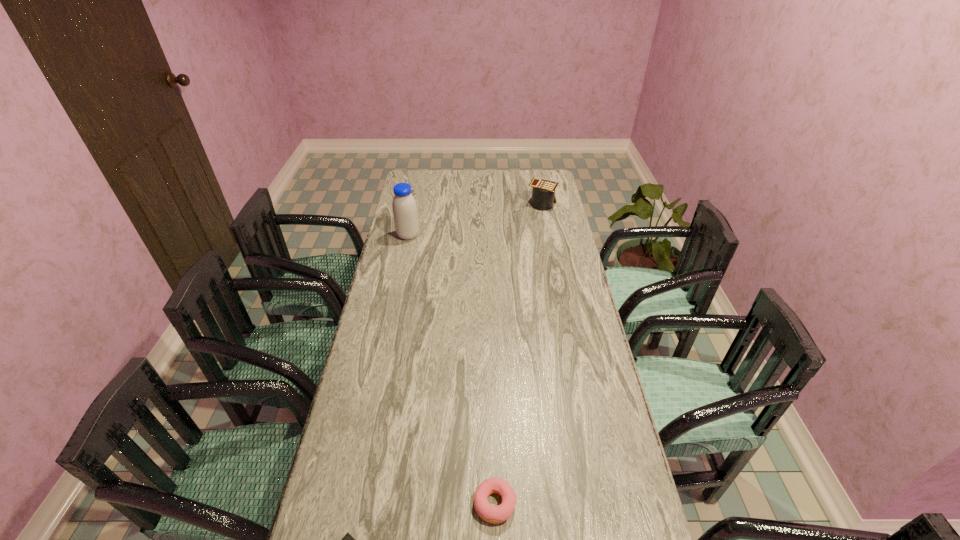
Find the location of `free space between the second shortest object and the soya milk`. free space between the second shortest object and the soya milk is located at coordinates (451, 369).

Identify the location of object that is the second nearest to the second shortest object. This screenshot has width=960, height=540. click(x=404, y=207).

You are a GUI agent. You are given a task and a screenshot of the screen. Output one action in this format:
    pyautogui.click(x=<x>, y=<y>)
    Task: Click on the object that is the nearest to the taller calculator
    The width and height of the screenshot is (960, 540).
    Given the screenshot: What is the action you would take?
    pyautogui.click(x=404, y=207)

At what (x,y) coordinates should I click in order to perform the action: click on vacant space that satisfies the following two spatial constraints: 1. on the back side of the second shortest object; 2. on the left side of the farther calculator. Please return your answer as a coordinate pair (x, y). This screenshot has height=540, width=960. Looking at the image, I should click on (488, 204).

I want to click on free region that satisfies the following two spatial constraints: 1. on the back side of the second tallest object; 2. on the right side of the second farthest object, so click(x=415, y=204).